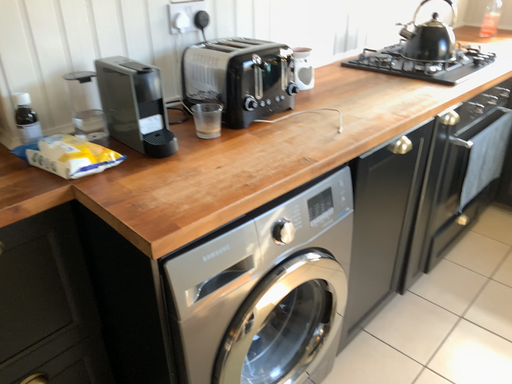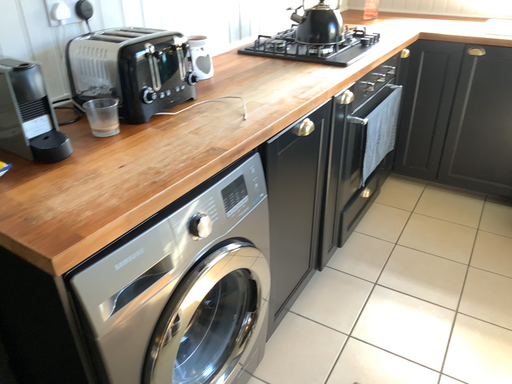
Question: How did the camera likely rotate when shooting the video?

Choices:
 (A) rotated left
 (B) rotated right

Answer: (B)